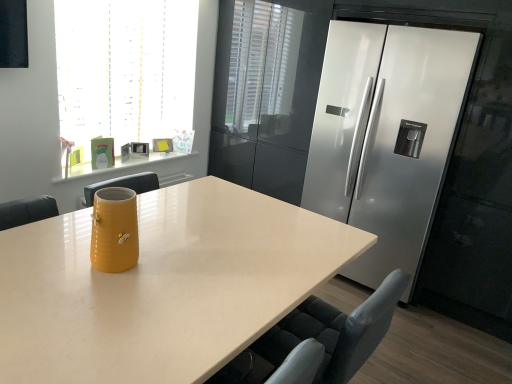
Where is `vacant area that lies to the right of yellow ceramic vase at center`? vacant area that lies to the right of yellow ceramic vase at center is located at coordinates (168, 266).